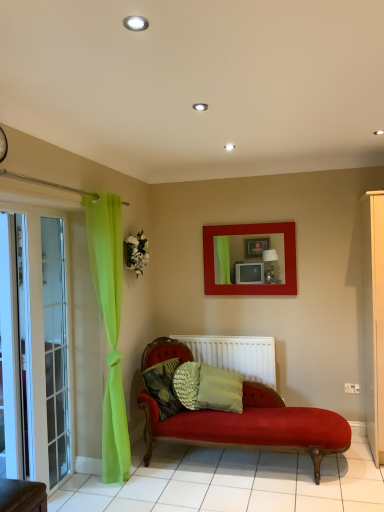
Question: From a real-world perspective, does white glass screen door at left, arranged as the 2th screen door when viewed from the back, stand above textured green pillow at center?

Choices:
 (A) no
 (B) yes

Answer: (B)

Question: Considering the relative sizes of white glass screen door at left, which is counted as the 1th screen door, starting from the front, and textured green pillow at center in the image provided, is white glass screen door at left, which is counted as the 1th screen door, starting from the front, wider than textured green pillow at center?

Choices:
 (A) yes
 (B) no

Answer: (B)

Question: From the image's perspective, is white glass screen door at left, which is counted as the 1th screen door, starting from the front, over textured green pillow at center?

Choices:
 (A) no
 (B) yes

Answer: (B)

Question: Considering the relative positions of white glass screen door at left, which is counted as the 1th screen door, starting from the front, and textured green pillow at center in the image provided, is white glass screen door at left, which is counted as the 1th screen door, starting from the front, to the right of textured green pillow at center from the viewer's perspective?

Choices:
 (A) yes
 (B) no

Answer: (B)

Question: Considering the relative sizes of white glass screen door at left, arranged as the 2th screen door when viewed from the back, and textured green pillow at center in the image provided, is white glass screen door at left, arranged as the 2th screen door when viewed from the back, smaller than textured green pillow at center?

Choices:
 (A) yes
 (B) no

Answer: (B)

Question: From a real-world perspective, is matte red picture frame at center above or below textured green pillow at center?

Choices:
 (A) above
 (B) below

Answer: (A)

Question: Looking at the image, does matte red picture frame at center seem bigger or smaller compared to textured green pillow at center?

Choices:
 (A) small
 (B) big

Answer: (B)

Question: Considering the positions of matte red picture frame at center and textured green pillow at center in the image, is matte red picture frame at center wider or thinner than textured green pillow at center?

Choices:
 (A) wide
 (B) thin

Answer: (B)

Question: Would you say matte red picture frame at center is inside or outside textured green pillow at center?

Choices:
 (A) inside
 (B) outside

Answer: (B)

Question: Is white glass screen door at left, which is counted as the 1th screen door, starting from the front, taller or shorter than textured green pillow at center?

Choices:
 (A) short
 (B) tall

Answer: (B)

Question: From the image's perspective, relative to textured green pillow at center, is white glass screen door at left, which is counted as the 1th screen door, starting from the front, above or below?

Choices:
 (A) above
 (B) below

Answer: (A)

Question: Is point (39, 465) closer or farther from the camera than point (170, 391)?

Choices:
 (A) closer
 (B) farther

Answer: (A)

Question: In terms of size, does white glass screen door at left, arranged as the 2th screen door when viewed from the back, appear bigger or smaller than textured green pillow at center?

Choices:
 (A) small
 (B) big

Answer: (B)

Question: In terms of size, does white glass screen door at left, arranged as the 2th screen door when viewed from the back, appear bigger or smaller than white matte radiator at center?

Choices:
 (A) small
 (B) big

Answer: (B)

Question: Does point (59, 449) appear closer or farther from the camera than point (185, 334)?

Choices:
 (A) farther
 (B) closer

Answer: (B)